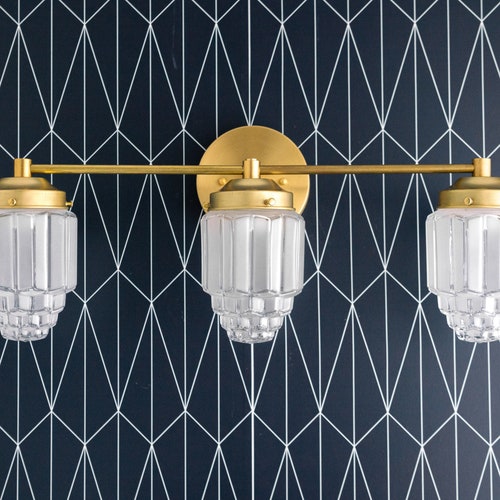
Identify the location of screws. The height and width of the screenshot is (500, 500). (467, 201), (271, 199), (290, 181), (218, 182), (9, 200), (69, 198).